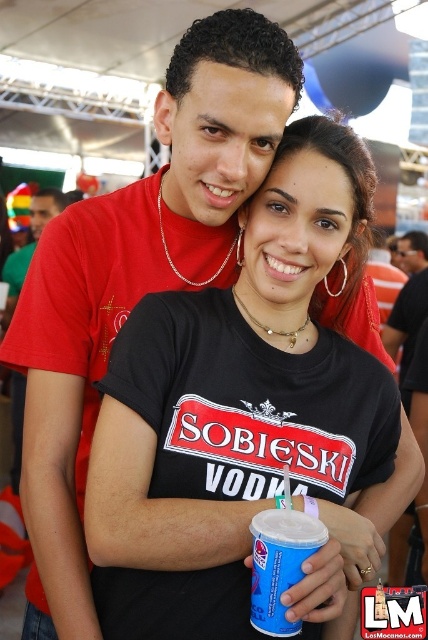
You are a photographer standing at the point marked by the coordinates point at (279,522). You want to take a photo of the two people in the scene. Given that your camera has a maximum focus range of 1.0 meters, will you be able to capture both individuals clearly in focus?

The two people are 1.08 meters apart. Since the camera can only focus up to 1.0 meters, the distance between them exceeds the focus range. Therefore, you won

You are at a party and want to grab the blue paper cup at center. The party area is represented on a grid from 0 to 1 in both x and y directions. If you are standing at position 0.5, 0.5, can you reach the cup without moving your feet?

A: The blue paper cup at center is located at position (279, 563). Since your current position is (214, 320), the horizontal distance is 0.381 and vertical distance is 0.154. Assuming an average reach of about 0.3 in either direction, you can reach the cup horizontally but may need to lean slightly forward vertically. However, since the total distance is within typical reaching range, you can likely grab it without moving your feet.